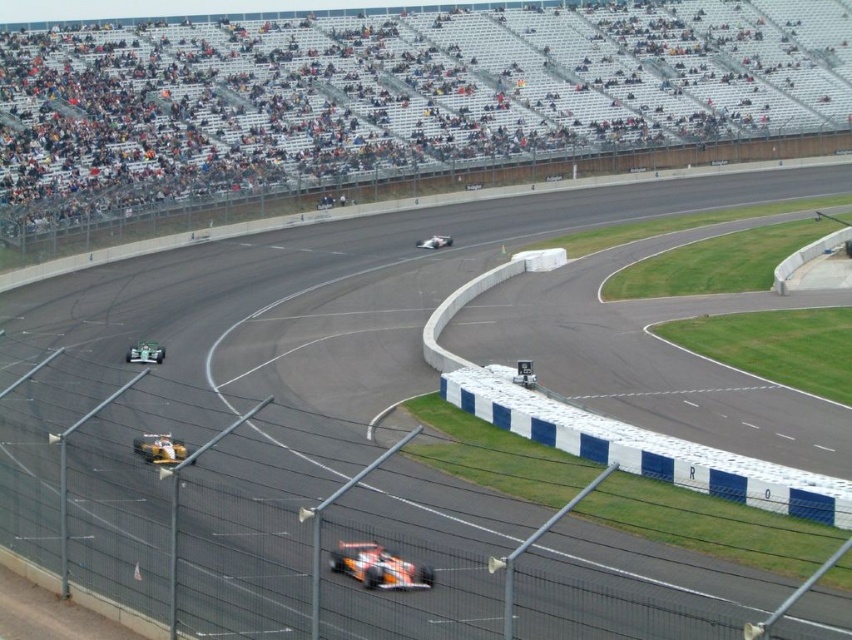
Question: Is yellow matte race car at lower left bigger than white glossy race car at center?

Choices:
 (A) no
 (B) yes

Answer: (A)

Question: Which object is closer to the camera taking this photo?

Choices:
 (A) white glossy race car at center
 (B) orange metallic race car at lower center
 (C) orange metallic race car at lower left
 (D) yellow matte race car at lower left

Answer: (B)

Question: Which point is closer to the camera taking this photo?

Choices:
 (A) (354, 541)
 (B) (131, 349)

Answer: (A)

Question: In this image, where is orange metallic race car at lower center located relative to orange metallic race car at lower left?

Choices:
 (A) left
 (B) right

Answer: (B)

Question: Considering the real-world distances, which object is closest to the white glossy race car at center?

Choices:
 (A) orange metallic race car at lower center
 (B) orange metallic race car at lower left

Answer: (B)

Question: Observing the image, what is the correct spatial positioning of orange metallic race car at lower left in reference to white glossy race car at center?

Choices:
 (A) below
 (B) above

Answer: (A)